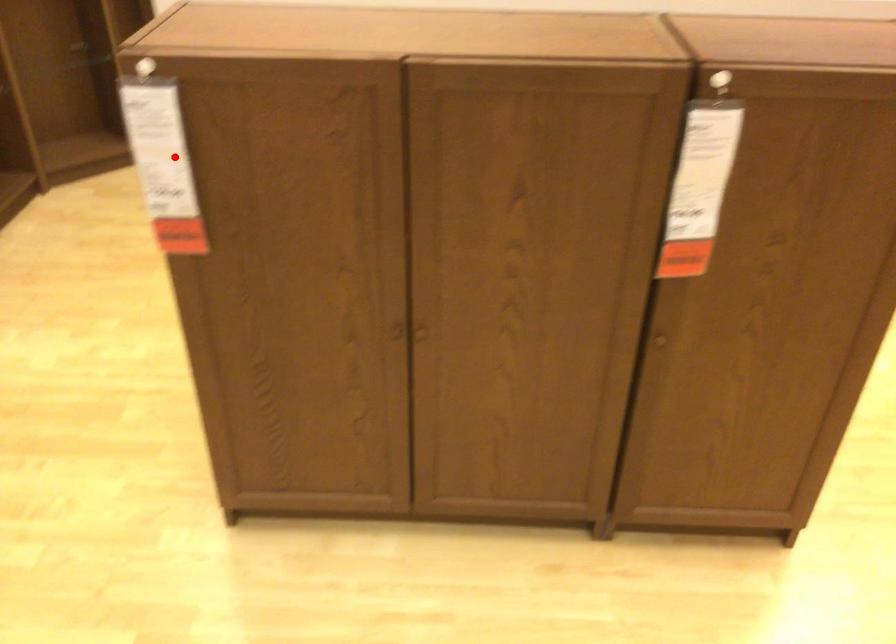
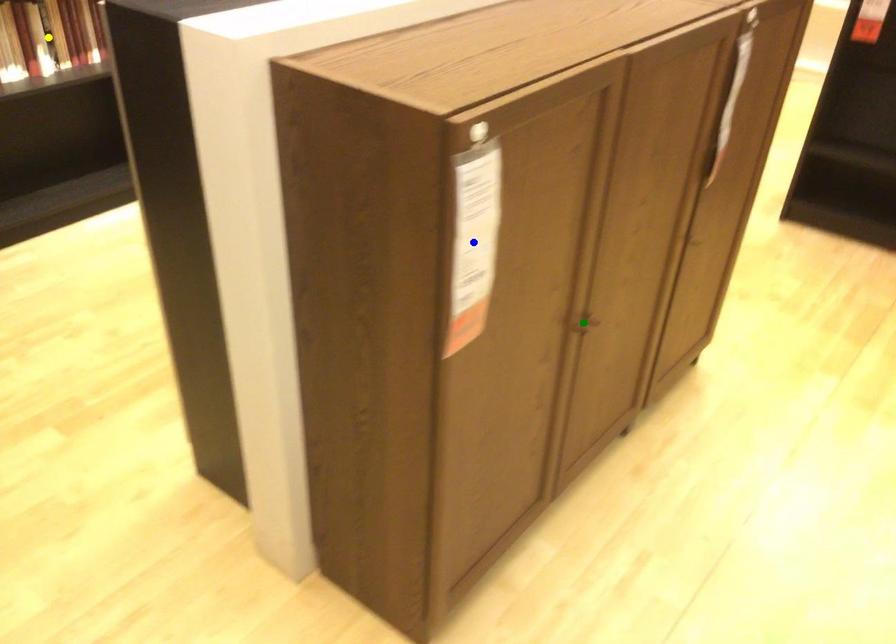
Question: I am providing you with two images of the same scene from different viewpoints. A red point is marked on the first image. You are given multiple points on the second image. Which spot in image 2 lines up with the point in image 1?

Choices:
 (A) blue point
 (B) yellow point
 (C) green point

Answer: (A)